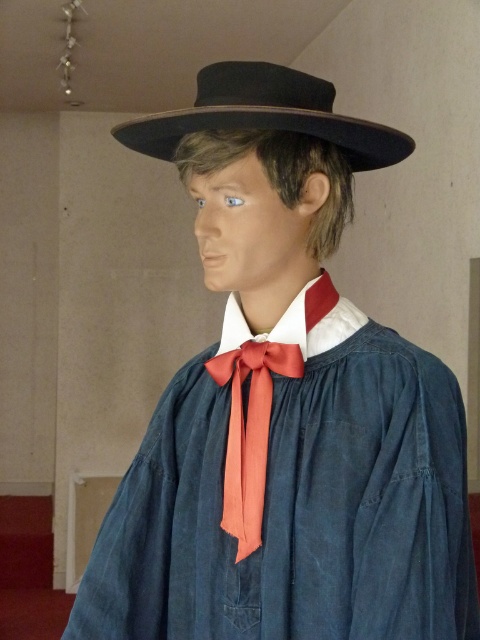
Which of these two, black felt fedora at upper center or satin orange bow tie at center, stands taller?

Standing taller between the two is satin orange bow tie at center.

Can you confirm if black felt fedora at upper center is smaller than satin orange bow tie at center?

No, black felt fedora at upper center is not smaller than satin orange bow tie at center.

Locate an element on the screen. Image resolution: width=480 pixels, height=640 pixels. black felt fedora at upper center is located at coordinates point(266,115).